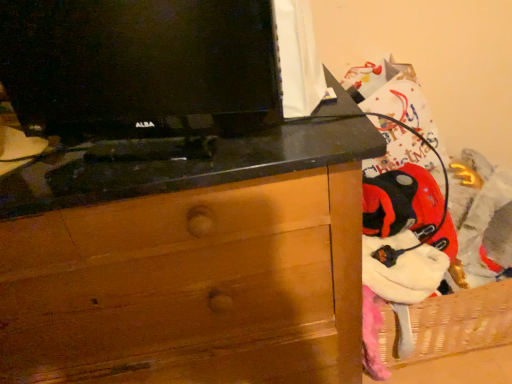
Question: Considering the relative positions of black glossy tv at upper left and wooden chest of drawers at center in the image provided, is black glossy tv at upper left to the left of wooden chest of drawers at center from the viewer's perspective?

Choices:
 (A) yes
 (B) no

Answer: (B)

Question: Is black glossy tv at upper left not inside wooden chest of drawers at center?

Choices:
 (A) yes
 (B) no

Answer: (A)

Question: From a real-world perspective, is black glossy tv at upper left located higher than wooden chest of drawers at center?

Choices:
 (A) no
 (B) yes

Answer: (B)

Question: Can you confirm if black glossy tv at upper left is bigger than wooden chest of drawers at center?

Choices:
 (A) yes
 (B) no

Answer: (B)

Question: Does black glossy tv at upper left come in front of wooden chest of drawers at center?

Choices:
 (A) no
 (B) yes

Answer: (B)

Question: Is black glossy tv at upper left shorter than wooden chest of drawers at center?

Choices:
 (A) yes
 (B) no

Answer: (A)

Question: Is wooden chest of drawers at center facing away from black glossy tv at upper left?

Choices:
 (A) no
 (B) yes

Answer: (A)

Question: Does wooden chest of drawers at center have a lesser width compared to black glossy tv at upper left?

Choices:
 (A) no
 (B) yes

Answer: (A)

Question: Is wooden chest of drawers at center in front of black glossy tv at upper left?

Choices:
 (A) yes
 (B) no

Answer: (B)

Question: From a real-world perspective, is wooden chest of drawers at center on black glossy tv at upper left?

Choices:
 (A) no
 (B) yes

Answer: (A)

Question: Is wooden chest of drawers at center smaller than black glossy tv at upper left?

Choices:
 (A) no
 (B) yes

Answer: (A)

Question: From a real-world perspective, does wooden chest of drawers at center sit lower than black glossy tv at upper left?

Choices:
 (A) yes
 (B) no

Answer: (A)

Question: In terms of width, does black glossy tv at upper left look wider or thinner when compared to wooden chest of drawers at center?

Choices:
 (A) wide
 (B) thin

Answer: (B)